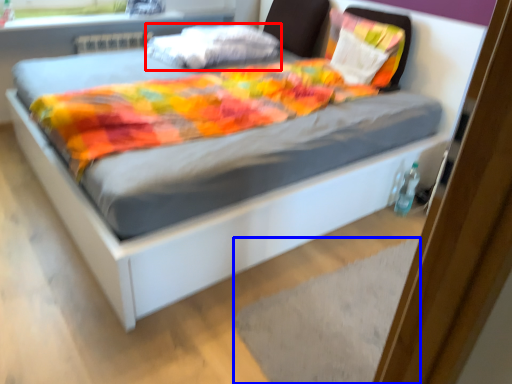
Question: Which point is closer to the camera, pillow (highlighted by a red box) or mat (highlighted by a blue box)?

Choices:
 (A) pillow
 (B) mat

Answer: (B)